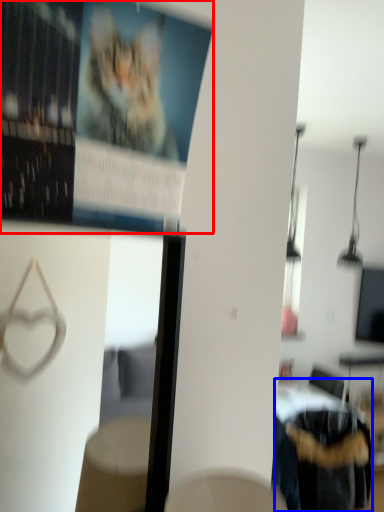
Question: Among these objects, which one is nearest to the camera, poster page (highlighted by a red box) or furniture (highlighted by a blue box)?

Choices:
 (A) poster page
 (B) furniture

Answer: (A)